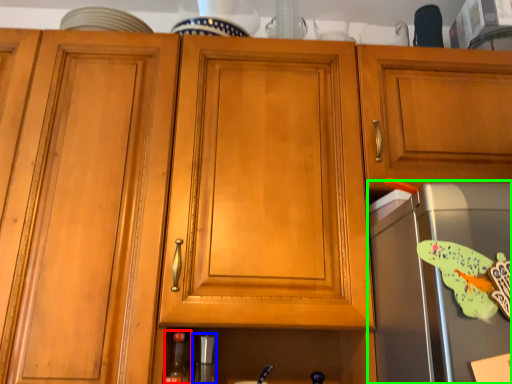
Question: Which object is positioned closest to bottle (highlighted by a red box)? Select from appliance (highlighted by a blue box) and appliance (highlighted by a green box).

Choices:
 (A) appliance
 (B) appliance

Answer: (A)